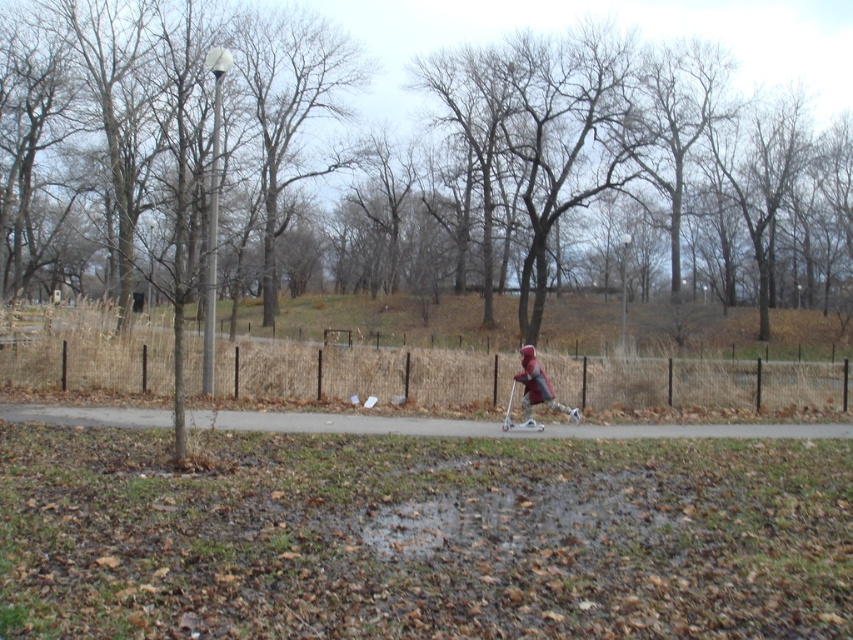
Based on the photo, you are a parent trying to locate your child who is riding a matte red scooter at center near the smooth asphalt path at center. From your position at the start of the path, which direction should you walk to find them?

The matte red scooter at center is to the right of the smooth asphalt path at center, so you should walk to the right along the path to find your child.

You are a parent watching your child play in the park. You see the matte red scooter at center and the matte red jacket at center. Which object is closer to the left side of the image?

The matte red scooter at center is positioned on the left side of the matte red jacket at center, so the scooter is closer to the left side of the image.